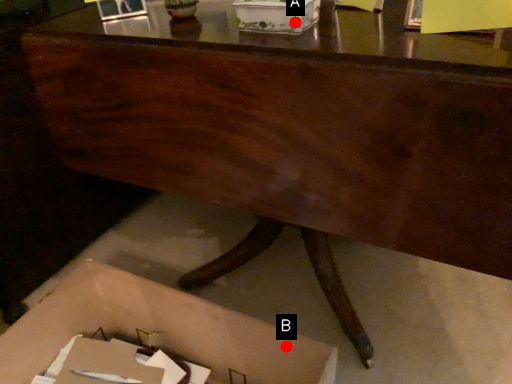
Question: Two points are circled on the image, labeled by A and B beside each circle. Which point is closer to the camera?

Choices:
 (A) A is closer
 (B) B is closer

Answer: (A)